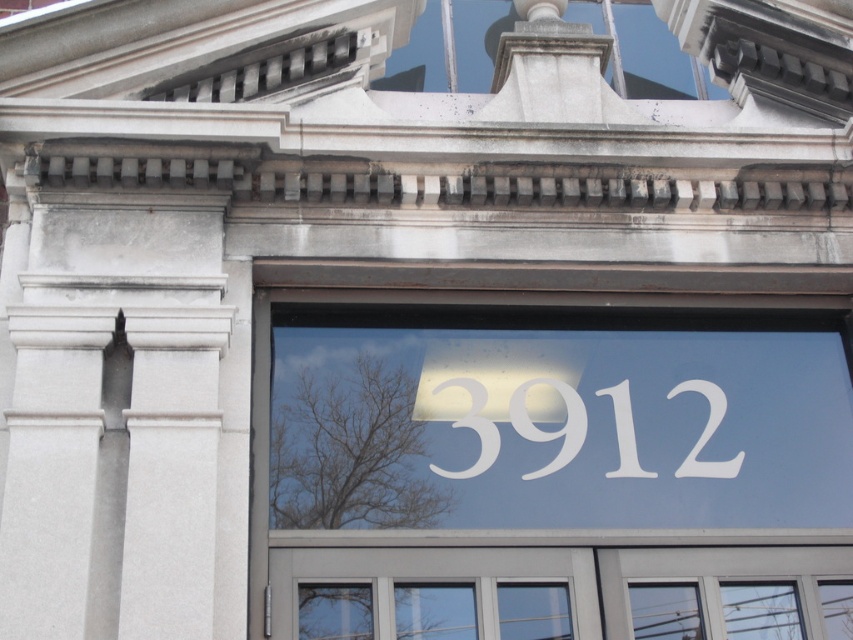
You are an architect reviewing a building facade and notice a point at coordinate [544,468]. What is located at that specific coordinate on the building facade?

At point [544,468] lies white vinyl numbers at center.

You are a delivery person trying to read the apartment number displayed on the building facade. You see two numbers at the center of the window area. Which number is higher up between the white vinyl numbers at center and the white matte number at center?

The white vinyl numbers at center is located above the white matte number at center, so the white vinyl numbers at center is higher up.

You are standing in front of a building and want to read the white vinyl numbers at center displayed on its facade. Considering your current position, can you clearly see the numbers without moving closer?

The white vinyl numbers at center are 24.54 meters away from the viewer, which is quite a distance. It might be difficult to read them clearly from this position without moving closer.